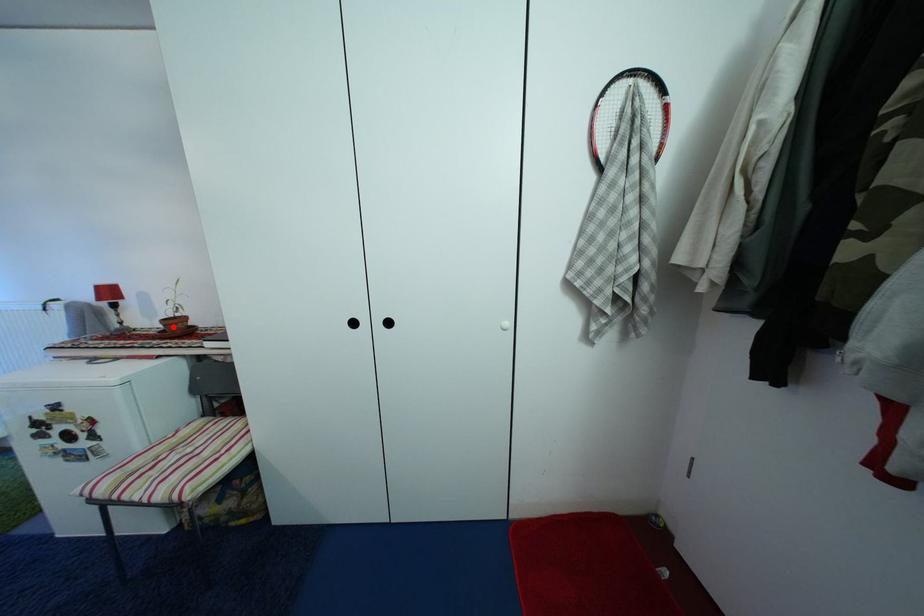
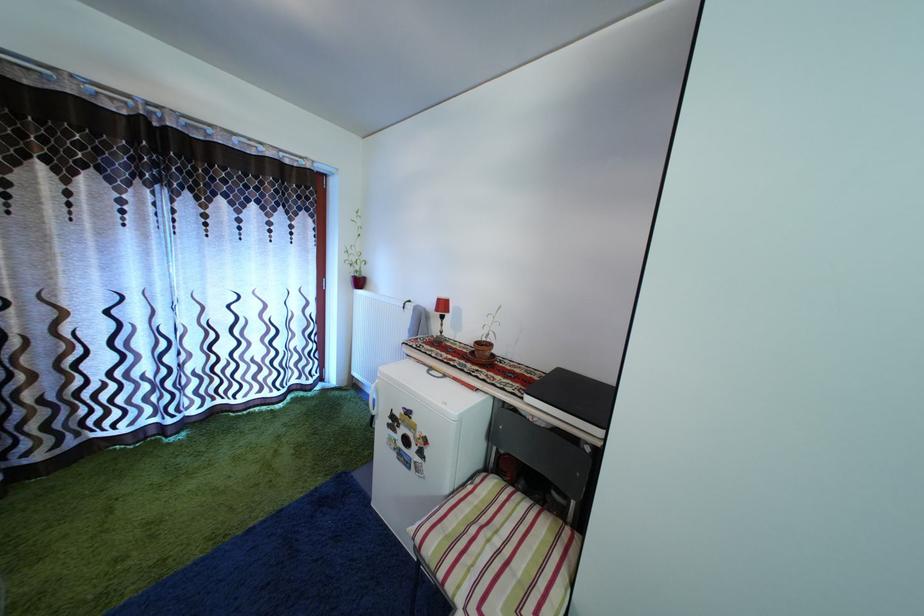
In the second image, find the point that corresponds to the highlighted location in the first image.

(485, 350)